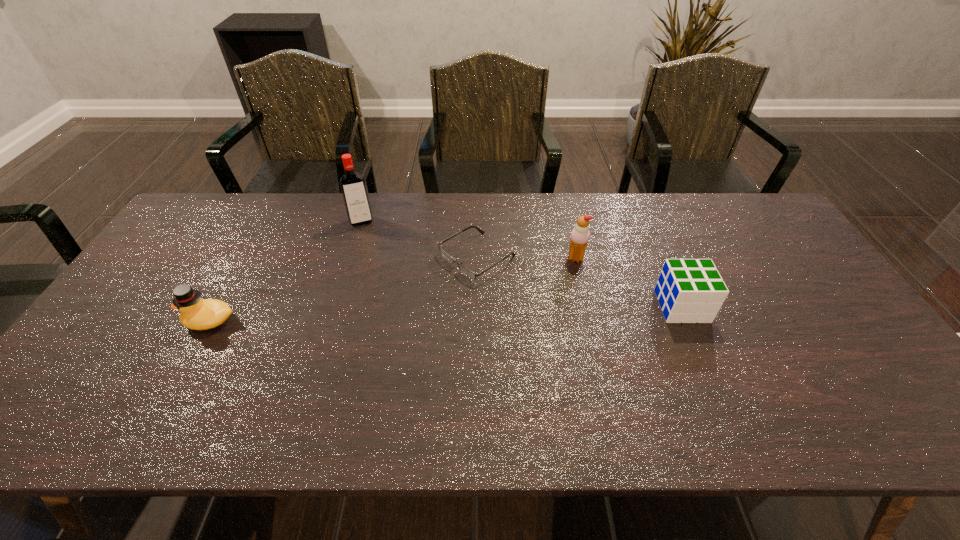
Point out which object is positioned as the second nearest to the cube. Please provide its 2D coordinates. Your answer should be formatted as a tuple, i.e. [(x, y)], where the tuple contains the x and y coordinates of a point satisfying the conditions above.

[(467, 272)]

Where is `blank area in the image that satisfies the following two spatial constraints: 1. on the front side of the cube; 2. on the red face of the farthest object`? blank area in the image that satisfies the following two spatial constraints: 1. on the front side of the cube; 2. on the red face of the farthest object is located at coordinates (335, 306).

You are a GUI agent. You are given a task and a screenshot of the screen. Output one action in this format:
    pyautogui.click(x=<x>, y=<y>)
    Task: Click on the vacant area that satisfies the following two spatial constraints: 1. on the front side of the cube; 2. on the red face of the shortest object
    The height and width of the screenshot is (540, 960).
    Given the screenshot: What is the action you would take?
    pyautogui.click(x=477, y=306)

Find the location of a particular element. vacant space that satisfies the following two spatial constraints: 1. on the front side of the rightmost object; 2. on the red face of the spectacles is located at coordinates (477, 306).